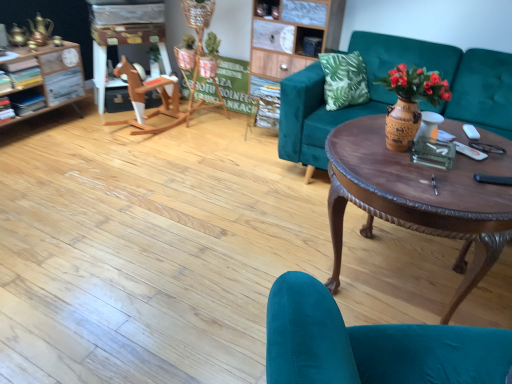
Question: Is teal velvet chair at lower right to the left of green cardboard sign at center from the viewer's perspective?

Choices:
 (A) yes
 (B) no

Answer: (B)

Question: From a real-world perspective, is teal velvet chair at lower right positioned under green cardboard sign at center based on gravity?

Choices:
 (A) yes
 (B) no

Answer: (B)

Question: Does teal velvet chair at lower right have a greater width compared to green cardboard sign at center?

Choices:
 (A) no
 (B) yes

Answer: (B)

Question: Is teal velvet chair at lower right with green cardboard sign at center?

Choices:
 (A) yes
 (B) no

Answer: (B)

Question: Considering the relative sizes of teal velvet chair at lower right and green cardboard sign at center in the image provided, is teal velvet chair at lower right smaller than green cardboard sign at center?

Choices:
 (A) yes
 (B) no

Answer: (B)

Question: Is brown polished wood coffee table at center wider or thinner than wooden vase with flowers at center?

Choices:
 (A) wide
 (B) thin

Answer: (A)

Question: From the image's perspective, relative to wooden vase with flowers at center, is brown polished wood coffee table at center above or below?

Choices:
 (A) below
 (B) above

Answer: (A)

Question: Considering the relative positions of brown polished wood coffee table at center and wooden vase with flowers at center in the image provided, is brown polished wood coffee table at center to the left or to the right of wooden vase with flowers at center?

Choices:
 (A) left
 (B) right

Answer: (B)

Question: Is brown polished wood coffee table at center bigger or smaller than wooden vase with flowers at center?

Choices:
 (A) small
 (B) big

Answer: (B)

Question: Considering the positions of wooden rocking horse at left and teal velvet couch at center in the image, is wooden rocking horse at left wider or thinner than teal velvet couch at center?

Choices:
 (A) wide
 (B) thin

Answer: (B)

Question: From the image's perspective, is wooden rocking horse at left positioned above or below teal velvet couch at center?

Choices:
 (A) below
 (B) above

Answer: (B)

Question: Looking at the image, does wooden rocking horse at left seem bigger or smaller compared to teal velvet couch at center?

Choices:
 (A) big
 (B) small

Answer: (B)

Question: Considering the relative positions of wooden rocking horse at left and teal velvet couch at center in the image provided, is wooden rocking horse at left to the left or to the right of teal velvet couch at center?

Choices:
 (A) left
 (B) right

Answer: (A)

Question: From the image's perspective, is green cardboard sign at center above or below teal velvet chair at lower right?

Choices:
 (A) above
 (B) below

Answer: (A)

Question: Considering the positions of green cardboard sign at center and teal velvet chair at lower right in the image, is green cardboard sign at center wider or thinner than teal velvet chair at lower right?

Choices:
 (A) thin
 (B) wide

Answer: (A)